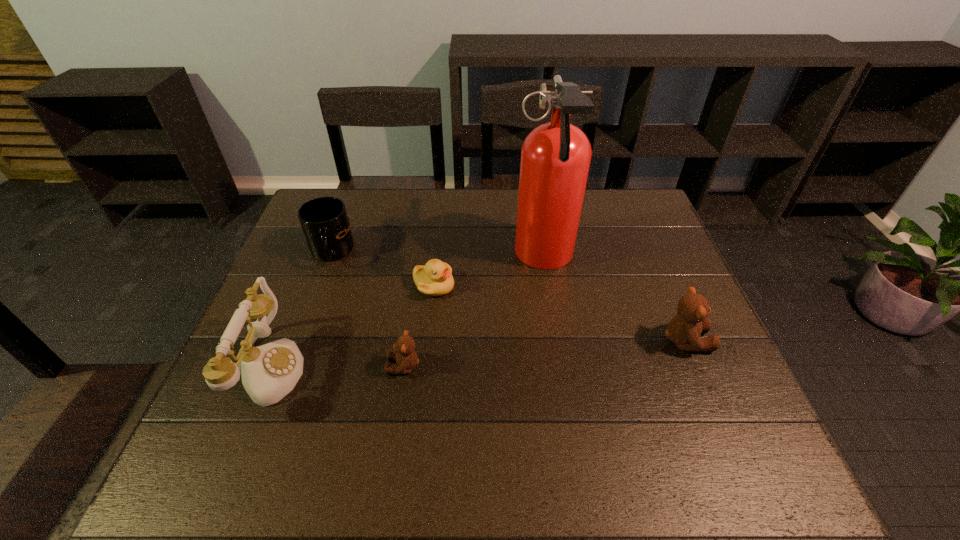
This screenshot has height=540, width=960. What are the coordinates of `empty space between the shorter teddy bear and the telephone` in the screenshot? It's located at (337, 367).

In order to click on free spot between the telephone and the taller teddy bear in this screenshot , I will do `click(478, 354)`.

Where is `vacant area between the left teddy bear and the tallest object`? vacant area between the left teddy bear and the tallest object is located at coordinates (473, 312).

Identify the location of free area in between the tallest object and the shorter teddy bear. The image size is (960, 540). (473, 312).

Image resolution: width=960 pixels, height=540 pixels. I want to click on unoccupied area between the right teddy bear and the mug, so click(509, 296).

Identify the location of free space between the rightmost object and the duckling. The width and height of the screenshot is (960, 540). (560, 313).

Where is `object that stands as the fourth closest to the shorter teddy bear`? The width and height of the screenshot is (960, 540). object that stands as the fourth closest to the shorter teddy bear is located at coordinates (324, 220).

Image resolution: width=960 pixels, height=540 pixels. What are the coordinates of `object that stands as the fifth closest to the telephone` in the screenshot? It's located at (684, 330).

Where is `free space that satisfies the following two spatial constraints: 1. with the handle on the side of the mug; 2. on the dial of the telephone`? The image size is (960, 540). free space that satisfies the following two spatial constraints: 1. with the handle on the side of the mug; 2. on the dial of the telephone is located at coordinates (289, 368).

You are a GUI agent. You are given a task and a screenshot of the screen. Output one action in this format:
    pyautogui.click(x=<x>, y=<y>)
    Task: Click on the blank area in the image that satisfies the following two spatial constraints: 1. with the handle on the side of the mug; 2. on the dial of the second tallest object
    This screenshot has height=540, width=960.
    Given the screenshot: What is the action you would take?
    (x=289, y=368)